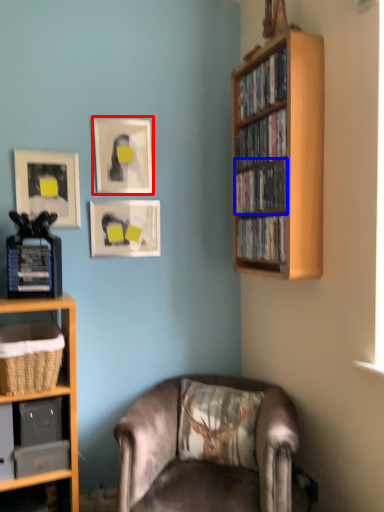
Question: Which object appears closest to the camera in this image, picture frame (highlighted by a red box) or book (highlighted by a blue box)?

Choices:
 (A) picture frame
 (B) book

Answer: (B)